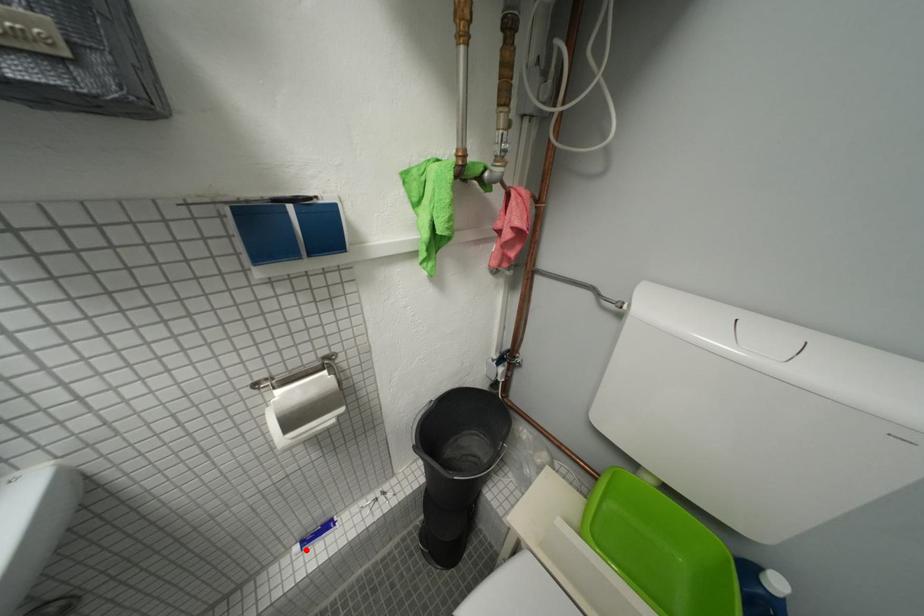
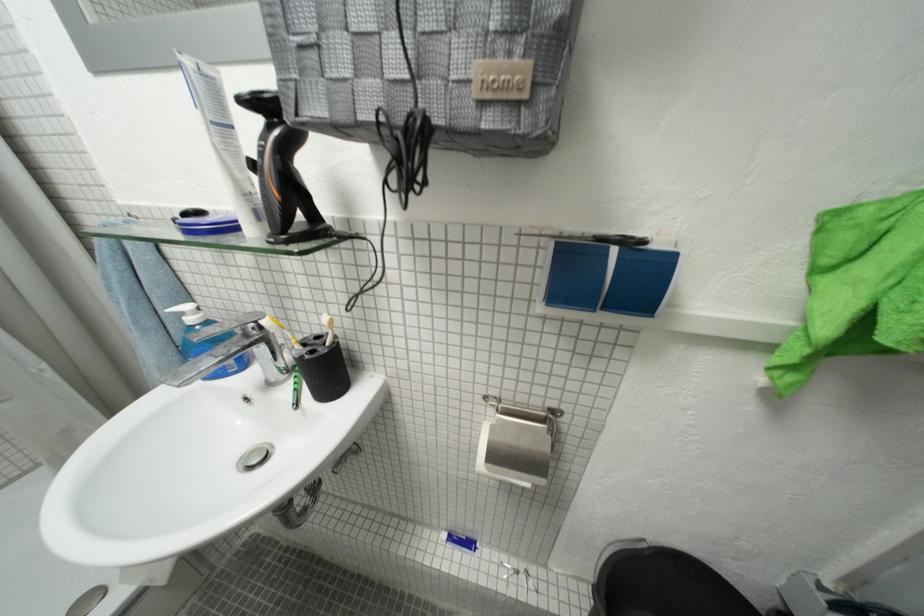
Question: I am providing you with two images of the same scene from different viewpoints. In image1, a red point is highlighted. Considering the same 3D point in image2, which of the following is correct?

Choices:
 (A) It is closer
 (B) It is farther

Answer: (B)